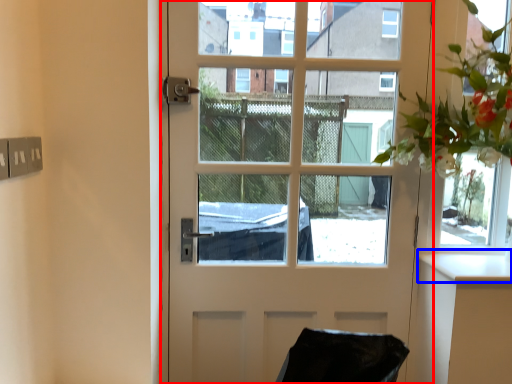
Question: Among these objects, which one is farthest to the camera, door (highlighted by a red box) or counter top (highlighted by a blue box)?

Choices:
 (A) door
 (B) counter top

Answer: (A)